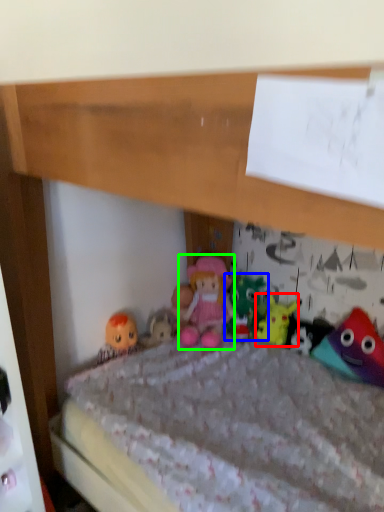
Question: Estimate the real-world distances between objects in this image. Which object is farther from toy (highlighted by a red box), toy (highlighted by a blue box) or person (highlighted by a green box)?

Choices:
 (A) toy
 (B) person

Answer: (B)